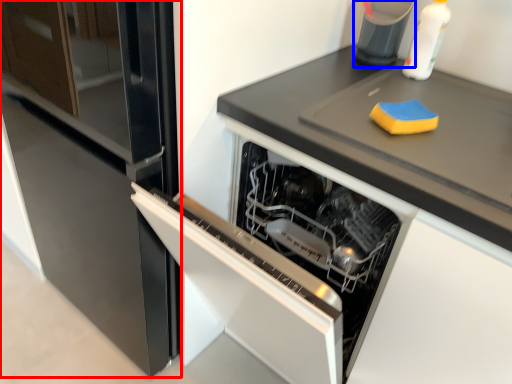
Question: Among these objects, which one is nearest to the camera, fridge (highlighted by a red box) or appliance (highlighted by a blue box)?

Choices:
 (A) fridge
 (B) appliance

Answer: (A)